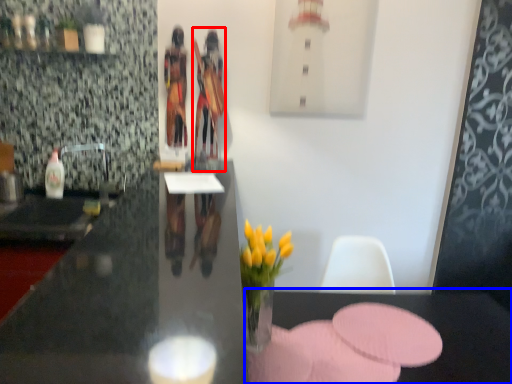
Question: Which point is closer to the camera, person (highlighted by a red box) or table (highlighted by a blue box)?

Choices:
 (A) person
 (B) table

Answer: (B)